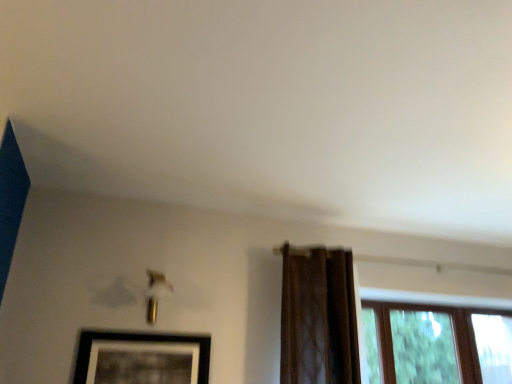
In order to face brown sheer curtain at right, should I rotate leftwards or rightwards?

Turn right approximately 9.282 degrees to face it.

What is the approximate height of brown sheer curtain at right?

brown sheer curtain at right is 39.28 inches in height.

Image resolution: width=512 pixels, height=384 pixels. What do you see at coordinates (318, 317) in the screenshot?
I see `brown sheer curtain at right` at bounding box center [318, 317].

This screenshot has height=384, width=512. Identify the location of brown sheer curtain at right. (318, 317).

What is the approximate width of black matte picture frame at lower left?

black matte picture frame at lower left is 1.41 inches in width.

Describe the element at coordinates (141, 358) in the screenshot. I see `black matte picture frame at lower left` at that location.

This screenshot has width=512, height=384. I want to click on black matte picture frame at lower left, so click(x=141, y=358).

Where is `brown sheer curtain at right`? brown sheer curtain at right is located at coordinates (318, 317).

Between black matte picture frame at lower left and brown sheer curtain at right, which one appears on the left side from the viewer's perspective?

black matte picture frame at lower left is more to the left.

Which is behind, black matte picture frame at lower left or brown sheer curtain at right?

brown sheer curtain at right is further from the camera.

Which is nearer, (89,339) or (323,301)?

The point (89,339) is in front.

From the image's perspective, which object appears higher, black matte picture frame at lower left or brown sheer curtain at right?

brown sheer curtain at right.

From a real-world perspective, is black matte picture frame at lower left physically above brown sheer curtain at right?

No, from a real-world perspective, black matte picture frame at lower left is not over brown sheer curtain at right

Which object is thinner, black matte picture frame at lower left or brown sheer curtain at right?

With smaller width is black matte picture frame at lower left.

Does black matte picture frame at lower left have a lesser height compared to brown sheer curtain at right?

Yes, black matte picture frame at lower left is shorter than brown sheer curtain at right.

Based on the photo, between black matte picture frame at lower left and brown sheer curtain at right, which one has larger size?

With larger size is brown sheer curtain at right.

From the picture: Is brown sheer curtain at right surrounded by black matte picture frame at lower left?

No, brown sheer curtain at right is located outside of black matte picture frame at lower left.

Can you see black matte picture frame at lower left touching brown sheer curtain at right?

No, black matte picture frame at lower left is not next to brown sheer curtain at right.

Is black matte picture frame at lower left turned away from brown sheer curtain at right?

No, black matte picture frame at lower left is not facing away from brown sheer curtain at right.

You are a GUI agent. You are given a task and a screenshot of the screen. Output one action in this format:
    pyautogui.click(x=<x>, y=<y>)
    Task: Click on the picture frame beneath the brown sheer curtain at right (from a real-world perspective)
    This screenshot has width=512, height=384.
    Given the screenshot: What is the action you would take?
    pyautogui.click(x=141, y=358)

Which object is positioned more to the right, brown sheer curtain at right or black matte picture frame at lower left?

From the viewer's perspective, brown sheer curtain at right appears more on the right side.

In the image, is brown sheer curtain at right positioned in front of or behind black matte picture frame at lower left?

brown sheer curtain at right is positioned farther from the viewer than black matte picture frame at lower left.

Considering the points (354, 354) and (140, 351), which point is in front, point (354, 354) or point (140, 351)?

The point (140, 351) is closer.

Based on the photo, from the image's perspective, between brown sheer curtain at right and black matte picture frame at lower left, which one is located above?

brown sheer curtain at right, from the image's perspective.

From a real-world perspective, who is located lower, brown sheer curtain at right or black matte picture frame at lower left?

black matte picture frame at lower left.

Considering the sizes of objects brown sheer curtain at right and black matte picture frame at lower left in the image provided, who is thinner, brown sheer curtain at right or black matte picture frame at lower left?

With smaller width is black matte picture frame at lower left.

In the scene shown: Does brown sheer curtain at right have a greater height compared to black matte picture frame at lower left?

Indeed, brown sheer curtain at right has a greater height compared to black matte picture frame at lower left.

Considering the sizes of brown sheer curtain at right and black matte picture frame at lower left in the image, is brown sheer curtain at right bigger or smaller than black matte picture frame at lower left?

Considering their sizes, brown sheer curtain at right takes up more space than black matte picture frame at lower left.

Is brown sheer curtain at right located outside black matte picture frame at lower left?

Indeed, brown sheer curtain at right is completely outside black matte picture frame at lower left.

Would you say brown sheer curtain at right is a long distance from black matte picture frame at lower left?

No.

Is brown sheer curtain at right facing towards black matte picture frame at lower left?

No, brown sheer curtain at right is not aimed at black matte picture frame at lower left.

Can you tell me how much brown sheer curtain at right and black matte picture frame at lower left differ in facing direction?

The angular difference between brown sheer curtain at right and black matte picture frame at lower left is 0.001 degrees.

Find the location of a particular element. This screenshot has width=512, height=384. picture frame lying on the left of brown sheer curtain at right is located at coordinates (141, 358).

What are the coordinates of `picture frame that is below the brown sheer curtain at right (from the image's perspective)` in the screenshot? It's located at (141, 358).

Locate an element on the screen. The height and width of the screenshot is (384, 512). curtain above the black matte picture frame at lower left (from the image's perspective) is located at coordinates (318, 317).